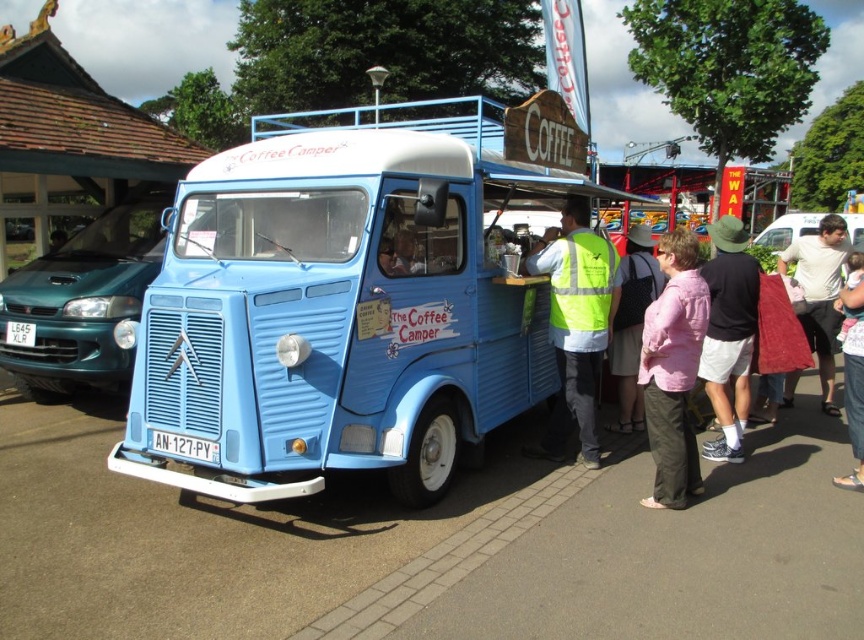
You are standing next to the vintage blue Citroen H Van and want to move to the teal glossy sedan at left. Which direction should you walk to reach it?

The teal glossy sedan at left is located at point (81, 304), so you should walk to the left to reach it.